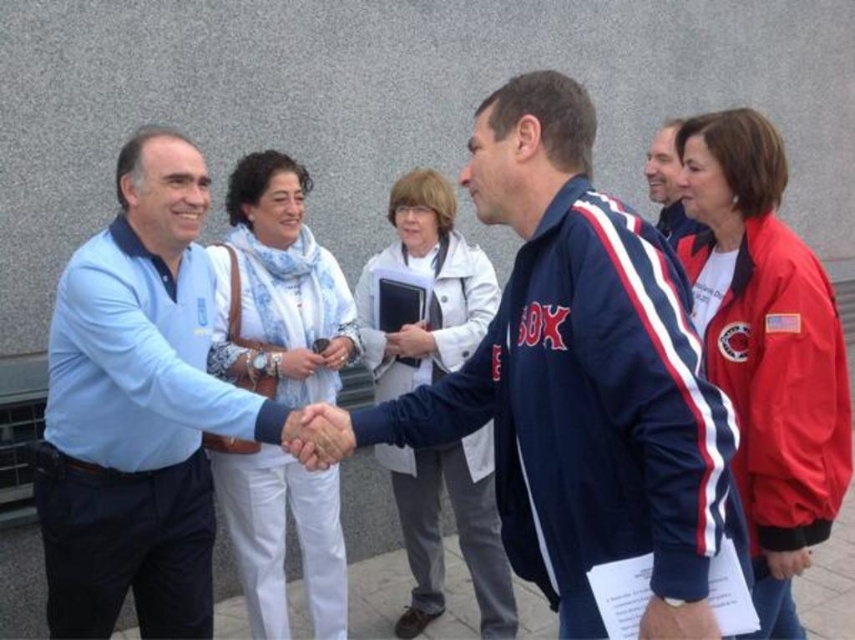
Does smooth skin handshake at center appear under white matte hand at center?

Indeed, smooth skin handshake at center is positioned under white matte hand at center.

The image size is (855, 640). I want to click on smooth skin handshake at center, so click(317, 435).

This screenshot has width=855, height=640. What do you see at coordinates (276, 285) in the screenshot?
I see `white cotton scarf at center` at bounding box center [276, 285].

Is white cotton scarf at center positioned before matte black phone at center?

That is True.

The height and width of the screenshot is (640, 855). Identify the location of white cotton scarf at center. (276, 285).

Who is taller, red jacket at right or white matte hand at center?

red jacket at right

Between point (765, 506) and point (408, 355), which one is positioned behind?

The point (408, 355) is more distant.

Which is behind, point (758, 360) or point (408, 324)?

Point (408, 324)

Where is `red jacket at right`? This screenshot has height=640, width=855. red jacket at right is located at coordinates (765, 348).